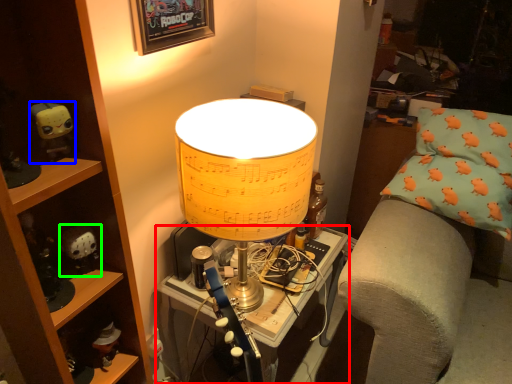
Question: Considering the real-world distances, which object is farthest from table (highlighted by a red box)? toy (highlighted by a blue box) or toy (highlighted by a green box)?

Choices:
 (A) toy
 (B) toy

Answer: (A)